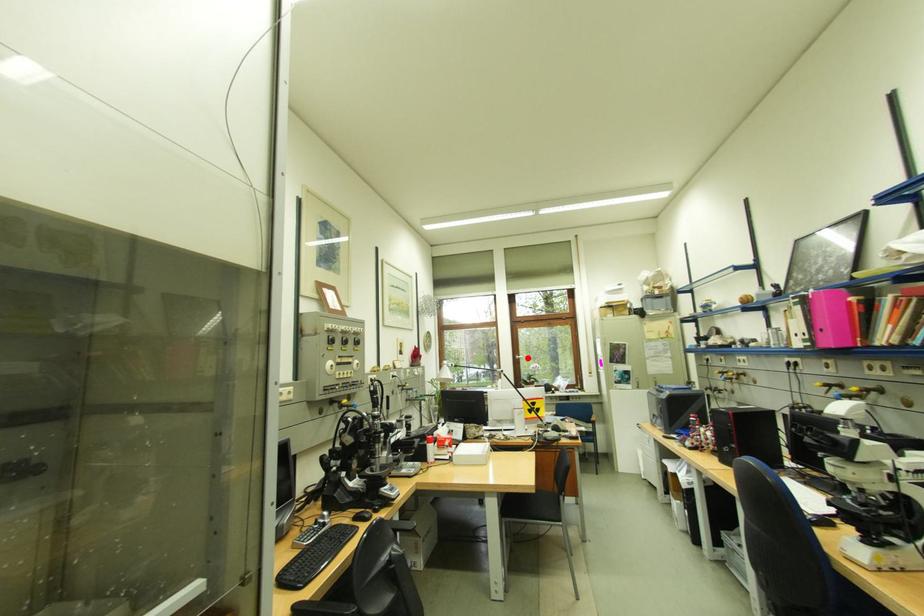
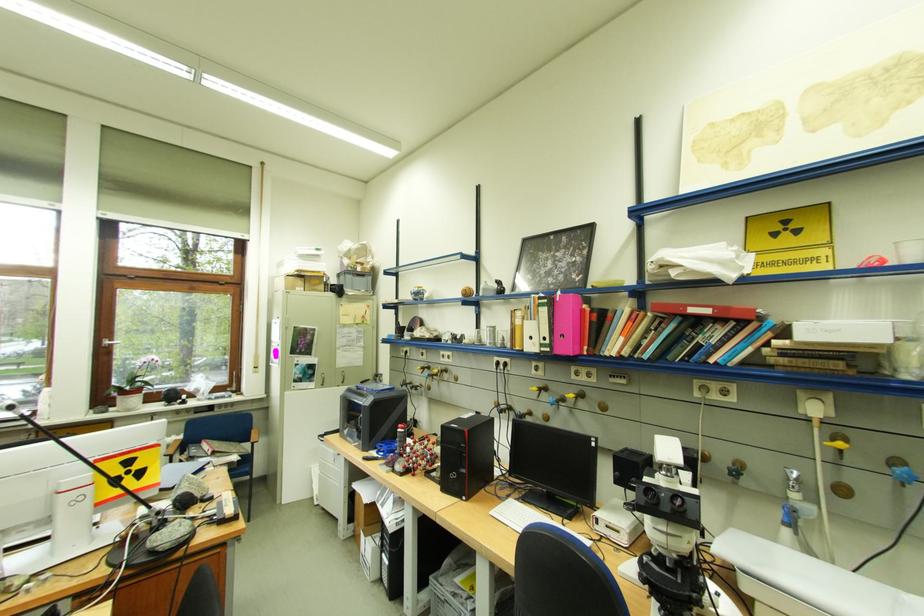
Find the pixel in the second image that matches the highlighted location in the first image.

(117, 342)